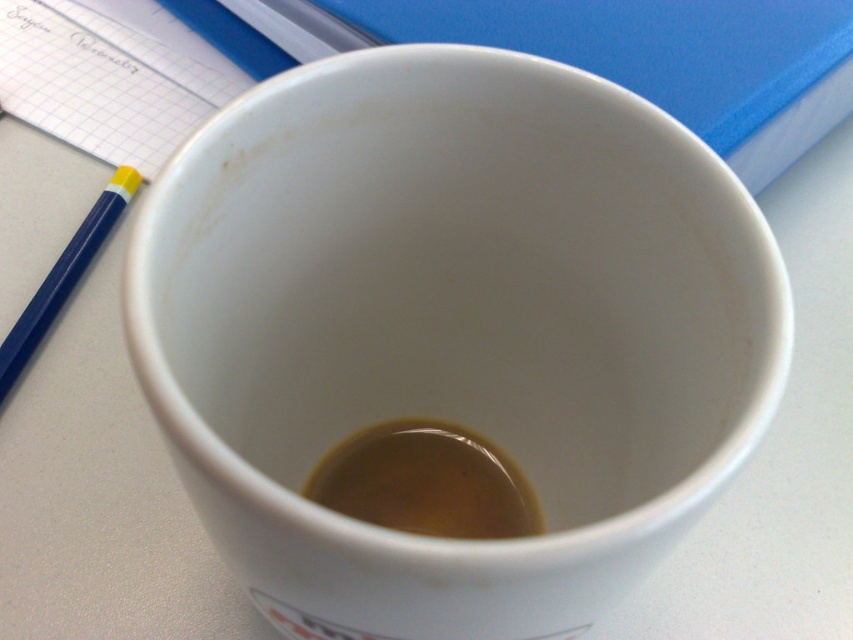
Question: Estimate the real-world distances between objects in this image. Which object is farther from the blue plastic pencil at left?

Choices:
 (A) white ceramic mug at center
 (B) brown matte liquid at center

Answer: (A)

Question: Where is white ceramic mug at center located in relation to blue plastic pencil at left in the image?

Choices:
 (A) above
 (B) below

Answer: (B)

Question: Is brown matte liquid at center bigger than blue plastic pencil at left?

Choices:
 (A) no
 (B) yes

Answer: (A)

Question: Based on their relative distances, which object is nearer to the white ceramic mug at center?

Choices:
 (A) brown matte liquid at center
 (B) blue plastic pencil at left

Answer: (A)

Question: Can you confirm if white ceramic mug at center is thinner than blue plastic pencil at left?

Choices:
 (A) yes
 (B) no

Answer: (B)

Question: Estimate the real-world distances between objects in this image. Which object is farther from the blue plastic pencil at left?

Choices:
 (A) brown matte liquid at center
 (B) white ceramic mug at center

Answer: (B)